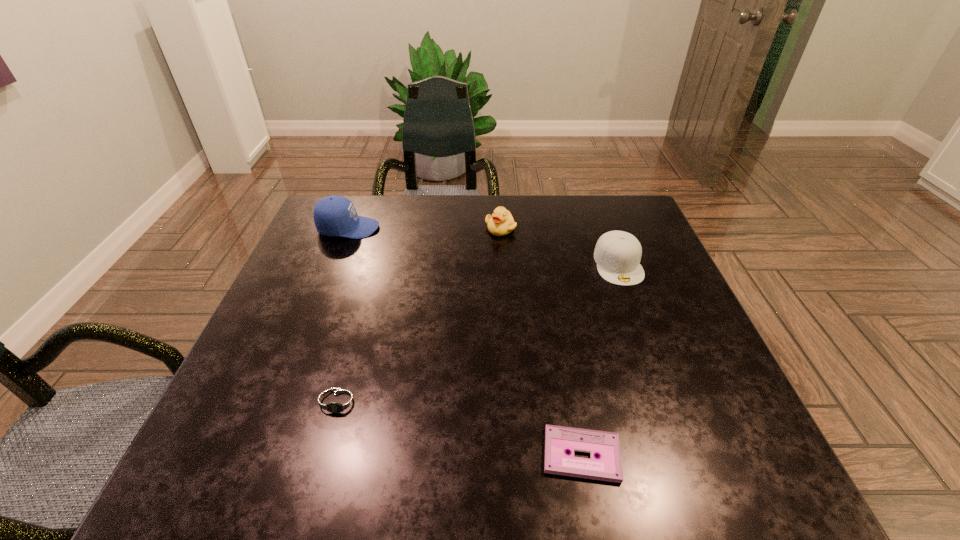
At what (x,y) coordinates should I click in order to perform the action: click on the taller cap. Please return your answer as a coordinate pair (x, y). Image resolution: width=960 pixels, height=540 pixels. Looking at the image, I should click on (335, 215).

Identify the location of the left cap. coord(335,215).

Image resolution: width=960 pixels, height=540 pixels. In order to click on duckling in this screenshot , I will do `click(501, 223)`.

The height and width of the screenshot is (540, 960). Find the location of `the right cap`. the right cap is located at coordinates (617, 253).

Where is `the shorter cap`? The height and width of the screenshot is (540, 960). the shorter cap is located at coordinates (617, 253).

Find the location of a particular element. This screenshot has width=960, height=540. watch is located at coordinates (339, 403).

The width and height of the screenshot is (960, 540). In order to click on videotape in this screenshot , I will do `click(558, 439)`.

Where is `the fourth object from left to right`? the fourth object from left to right is located at coordinates (558, 439).

Locate an element on the screen. The height and width of the screenshot is (540, 960). vacant position located 0.330m on the front-facing side of the tallest object is located at coordinates (495, 228).

Identify the location of free spot located on the front-facing side of the third object from left to right. The image size is (960, 540). (506, 312).